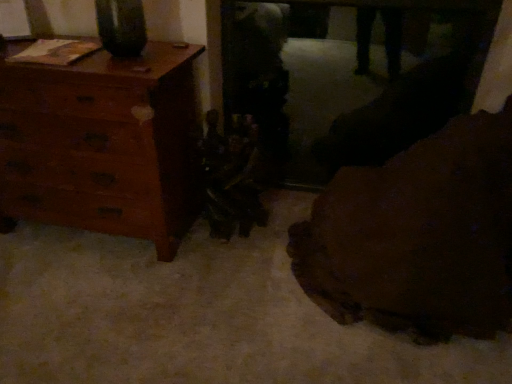
Question: Is brown leather couch at lower right smaller than wooden dresser at left?

Choices:
 (A) yes
 (B) no

Answer: (B)

Question: Considering the relative positions of brown leather couch at lower right and wooden dresser at left in the image provided, is brown leather couch at lower right in front of wooden dresser at left?

Choices:
 (A) no
 (B) yes

Answer: (B)

Question: Can you confirm if brown leather couch at lower right is shorter than wooden dresser at left?

Choices:
 (A) no
 (B) yes

Answer: (B)

Question: Does brown leather couch at lower right have a larger size compared to wooden dresser at left?

Choices:
 (A) yes
 (B) no

Answer: (A)

Question: Does brown leather couch at lower right appear on the right side of wooden dresser at left?

Choices:
 (A) yes
 (B) no

Answer: (A)

Question: Is brown leather couch at lower right positioned behind wooden dresser at left?

Choices:
 (A) no
 (B) yes

Answer: (A)

Question: Can you confirm if wooden dresser at left is shorter than brown leather couch at lower right?

Choices:
 (A) no
 (B) yes

Answer: (A)

Question: Does wooden dresser at left appear on the left side of brown leather couch at lower right?

Choices:
 (A) no
 (B) yes

Answer: (B)

Question: Could you tell me if wooden dresser at left is facing brown leather couch at lower right?

Choices:
 (A) no
 (B) yes

Answer: (A)

Question: From the image's perspective, is wooden dresser at left above brown leather couch at lower right?

Choices:
 (A) no
 (B) yes

Answer: (B)

Question: From a real-world perspective, is wooden dresser at left on top of brown leather couch at lower right?

Choices:
 (A) no
 (B) yes

Answer: (A)

Question: Can you confirm if wooden dresser at left is smaller than brown leather couch at lower right?

Choices:
 (A) yes
 (B) no

Answer: (A)

Question: Considering the positions of wooden dresser at left and brown leather couch at lower right in the image, is wooden dresser at left wider or thinner than brown leather couch at lower right?

Choices:
 (A) thin
 (B) wide

Answer: (A)